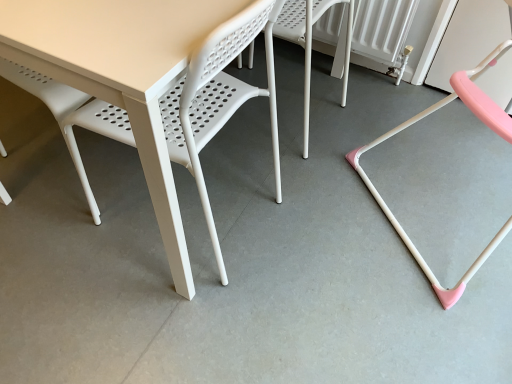
Where is `vacant space underneath white plastic chair at center, the second chair viewed from the right (from a real-world perspective)`? vacant space underneath white plastic chair at center, the second chair viewed from the right (from a real-world perspective) is located at coordinates (289, 122).